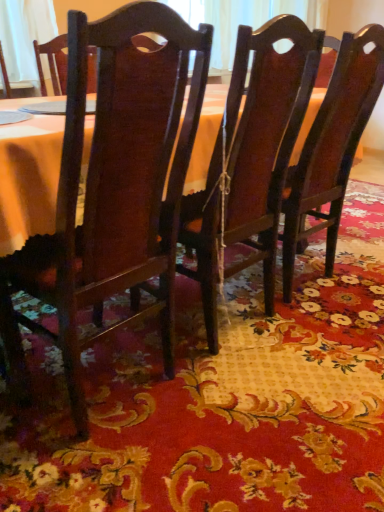
Image resolution: width=384 pixels, height=512 pixels. I want to click on vacant space in front of dark wood chair at center, which ranks as the 2th chair in right-to-left order, so click(x=262, y=409).